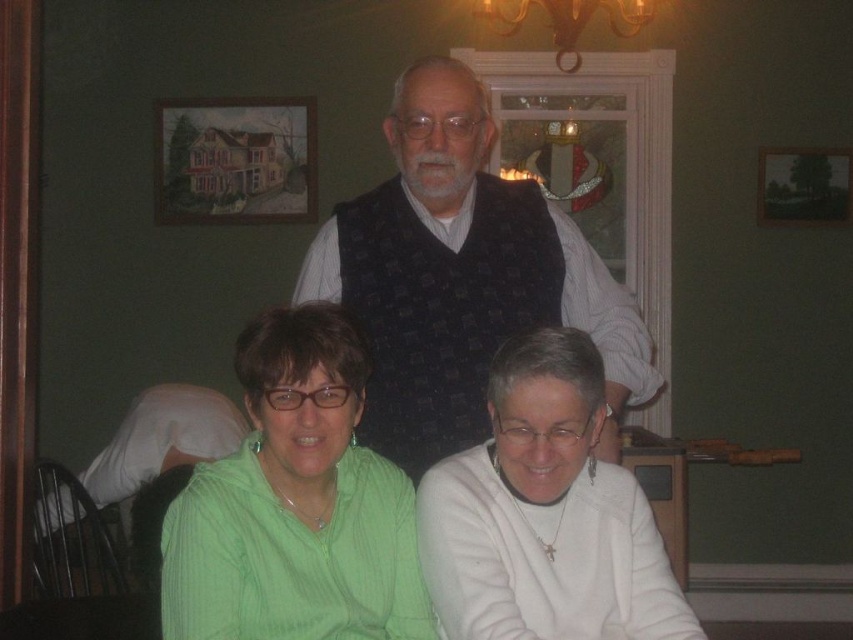
You are standing in the room and want to locate the dark blue textured vest at center. Based on the coordinates provided, where should you look?

The dark blue textured vest at center is located at coordinates point (461, 276).